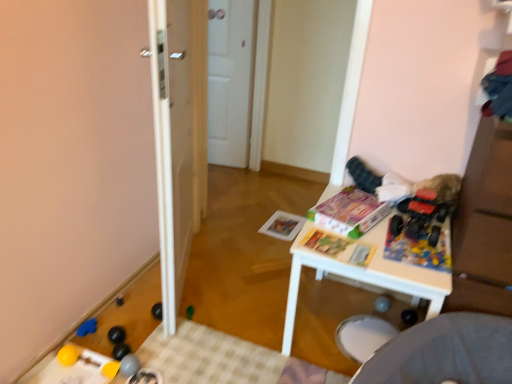
I want to click on vacant space in between matte paper magazine at center, the first magazine positioned from the front, and matte cardboard magazine at center, placed as the second magazine when sorted from front to back, so click(x=365, y=233).